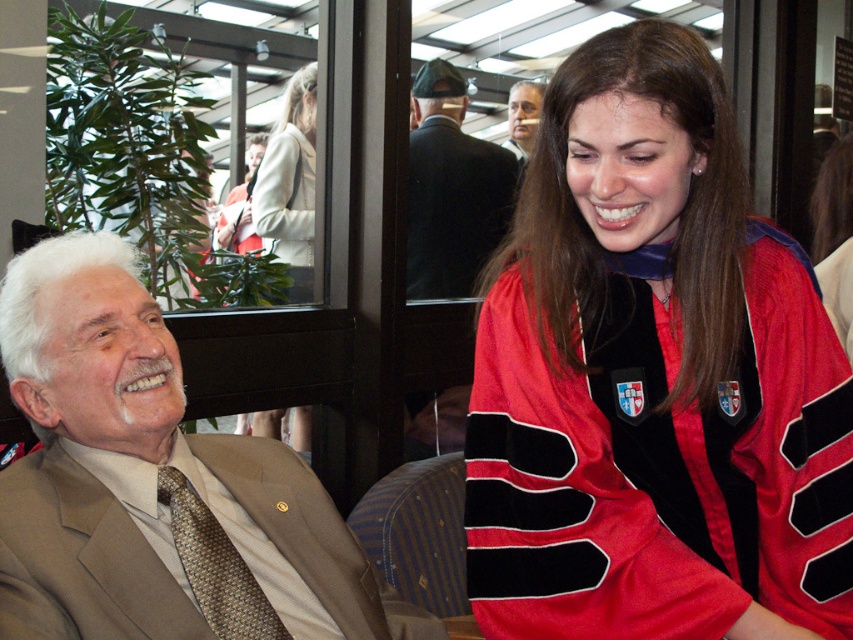
You are a photographer at an event and need to capture a photo of both the dark suit jacket at upper center and the white wool coat at upper center. Which one is on the right side when facing the image?

The dark suit jacket at upper center is positioned on the right side of white wool coat at upper center, so when facing the image, the dark suit jacket at upper center is on the right side.

You are a photographer trying to capture a portrait of the dark suit jacket at upper center for a fashion magazine. The magazine requires the jacket to be centered precisely at the golden ratio point of the image, which is located at coordinates approximately 0.618 on both axes. Based on the jacket position at point 0.297, 0.530, will you need to adjust its position to meet the magazine requirements?

The dark suit jacket at upper center is currently at coordinates (451, 189). The golden ratio point is at 0.618 on both axes, so the jacket needs to be moved to the right and slightly downward to reach the golden ratio point.